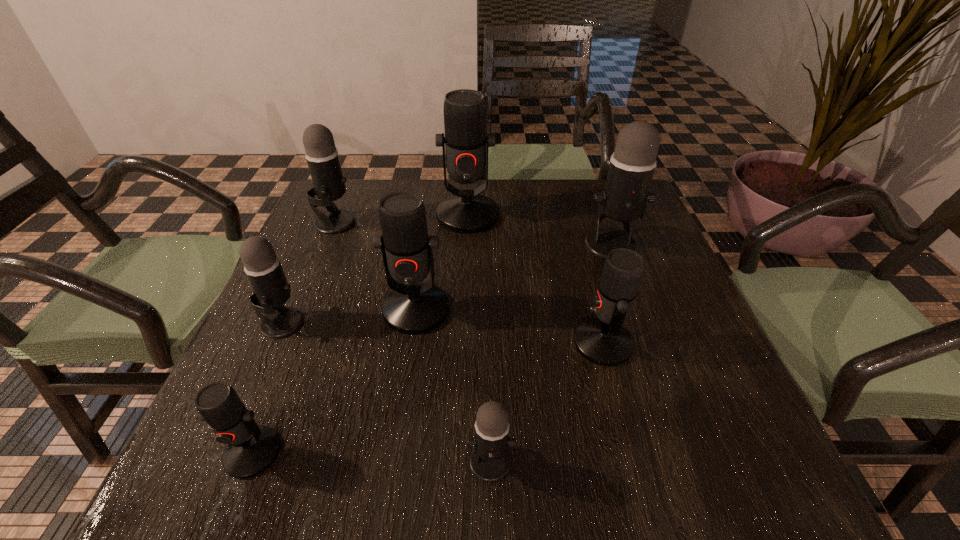
Locate an element on the screen. Image resolution: width=960 pixels, height=540 pixels. vacant space that's between the nearest red microphone and the third biggest gray microphone is located at coordinates (268, 388).

I want to click on free space between the smallest red microphone and the smallest gray microphone, so click(x=372, y=457).

Identify the location of free spot between the biggest gray microphone and the second biggest red microphone. (514, 278).

Identify the location of unoccupied area between the third gray microphone from left to right and the nearest red microphone. (372, 457).

Where is `vacant space in between the third smallest gray microphone and the third farthest gray microphone`? The width and height of the screenshot is (960, 540). vacant space in between the third smallest gray microphone and the third farthest gray microphone is located at coordinates (309, 273).

Image resolution: width=960 pixels, height=540 pixels. Find the location of `object that ranks as the sixth closest to the rightmost red microphone`. object that ranks as the sixth closest to the rightmost red microphone is located at coordinates (271, 290).

Choose which object is the second nearest neighbor to the second biggest red microphone. Please provide its 2D coordinates. Your answer should be formatted as a tuple, i.e. [(x, y)], where the tuple contains the x and y coordinates of a point satisfying the conditions above.

[(467, 211)]

This screenshot has width=960, height=540. Find the location of `microphone object that ranks as the sixth closest to the second gray microphone from right to left`. microphone object that ranks as the sixth closest to the second gray microphone from right to left is located at coordinates (467, 211).

Locate which microphone is the third closest to the rightmost red microphone. Please provide its 2D coordinates. Your answer should be formatted as a tuple, i.e. [(x, y)], where the tuple contains the x and y coordinates of a point satisfying the conditions above.

[(413, 307)]

Find the location of `red microphone that is the second closest to the rightmost gray microphone`. red microphone that is the second closest to the rightmost gray microphone is located at coordinates point(467,211).